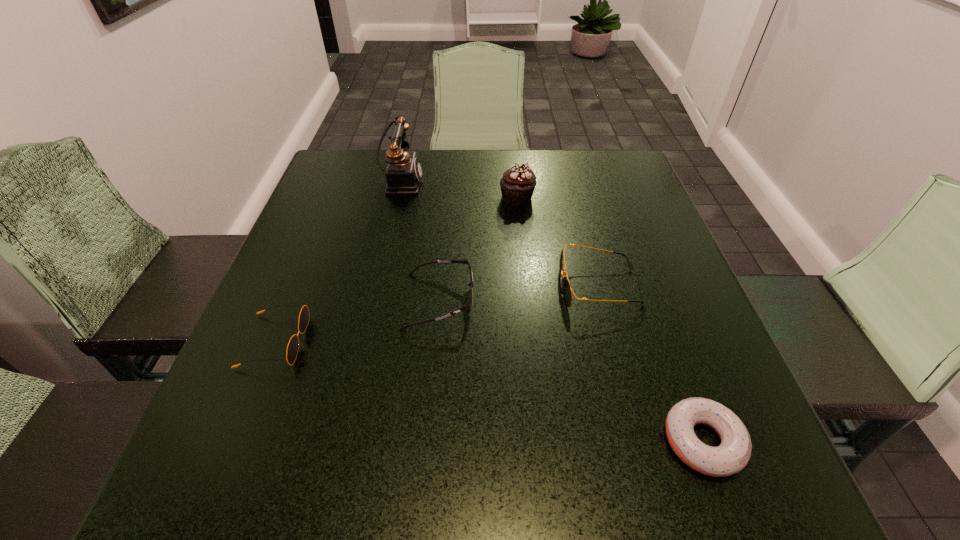
Where is `free spot between the doughnut and the telephone`? free spot between the doughnut and the telephone is located at coordinates (552, 311).

At what (x,y) coordinates should I click in order to perform the action: click on object that is the closest to the tallest object. Please return your answer as a coordinate pair (x, y). The width and height of the screenshot is (960, 540). Looking at the image, I should click on (517, 185).

Image resolution: width=960 pixels, height=540 pixels. What are the coordinates of `object that is the third closest one to the second sunglasses from right to left` in the screenshot? It's located at (517, 185).

Locate which sunglasses ranks in proximity to the rightmost sunglasses. Please provide its 2D coordinates. Your answer should be formatted as a tuple, i.e. [(x, y)], where the tuple contains the x and y coordinates of a point satisfying the conditions above.

[(468, 305)]

Identify which sunglasses is the second nearest to the rightmost sunglasses. Please provide its 2D coordinates. Your answer should be formatted as a tuple, i.e. [(x, y)], where the tuple contains the x and y coordinates of a point satisfying the conditions above.

[(292, 349)]

Where is `blank space that satisfies the following two spatial constraints: 1. on the front-facing side of the second sunglasses from right to left; 2. on the left side of the nearest object`? This screenshot has height=540, width=960. blank space that satisfies the following two spatial constraints: 1. on the front-facing side of the second sunglasses from right to left; 2. on the left side of the nearest object is located at coordinates (426, 441).

This screenshot has height=540, width=960. I want to click on vacant space that satisfies the following two spatial constraints: 1. on the front-facing side of the shortest sunglasses; 2. on the right side of the nearest object, so click(234, 441).

Find the location of a particular element. The width and height of the screenshot is (960, 540). vacant region that satisfies the following two spatial constraints: 1. on the front of the second tallest object at the rotary dial; 2. on the left side of the tallest object is located at coordinates (396, 198).